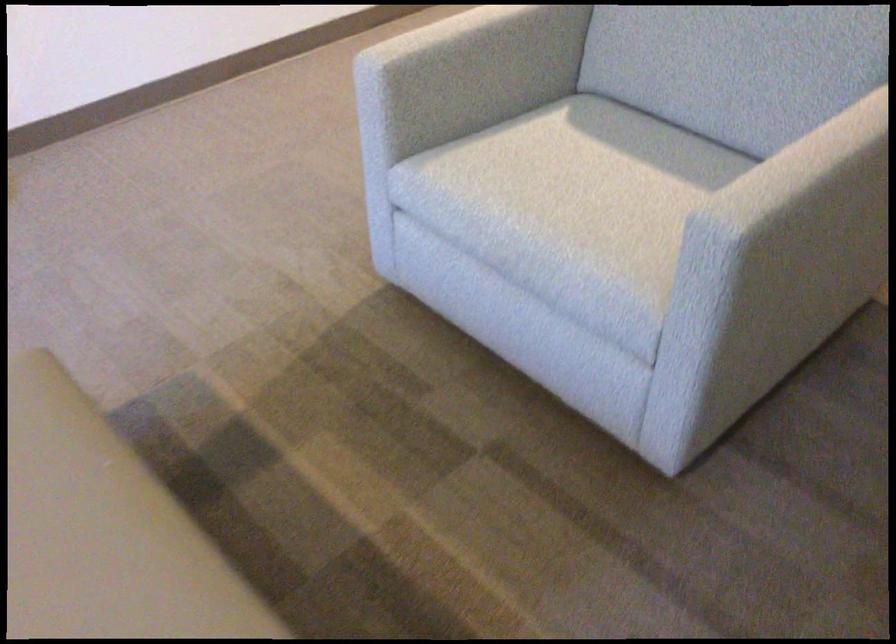
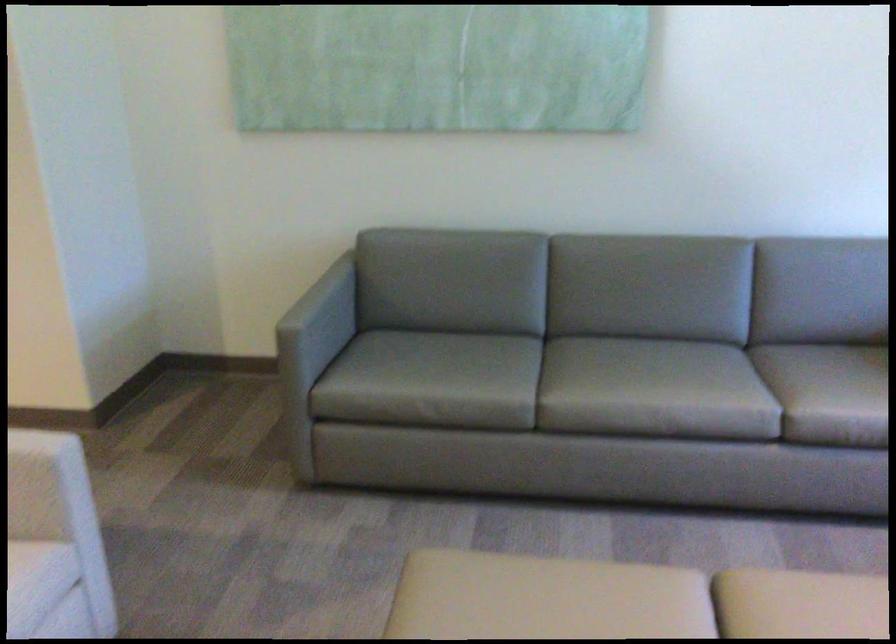
Where in the second image is the point corresponding to point (672, 324) from the first image?

(55, 542)